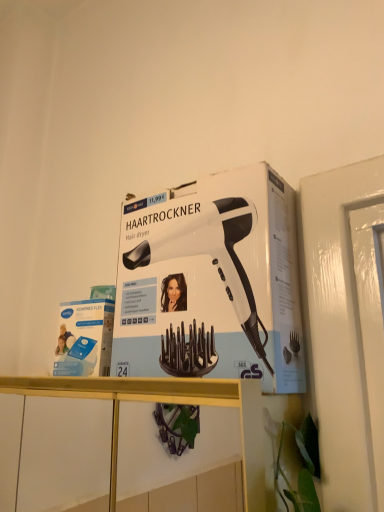
Question: Does point (253, 329) appear closer or farther from the camera than point (112, 438)?

Choices:
 (A) closer
 (B) farther

Answer: (A)

Question: Choose the correct answer: Is white matte hair dryer at upper center inside white glossy shelf at upper center or outside it?

Choices:
 (A) outside
 (B) inside

Answer: (A)

Question: From a real-world perspective, is white matte hair dryer at upper center physically located above or below white glossy shelf at upper center?

Choices:
 (A) above
 (B) below

Answer: (A)

Question: Does point (251, 445) appear closer or farther from the camera than point (172, 234)?

Choices:
 (A) closer
 (B) farther

Answer: (A)

Question: Is white glossy shelf at upper center situated inside white matte hair dryer at upper center or outside?

Choices:
 (A) outside
 (B) inside

Answer: (A)

Question: Looking at their shapes, would you say white glossy shelf at upper center is wider or thinner than white matte hair dryer at upper center?

Choices:
 (A) wide
 (B) thin

Answer: (A)

Question: Considering the positions of white glossy shelf at upper center and white matte hair dryer at upper center in the image, is white glossy shelf at upper center taller or shorter than white matte hair dryer at upper center?

Choices:
 (A) tall
 (B) short

Answer: (B)